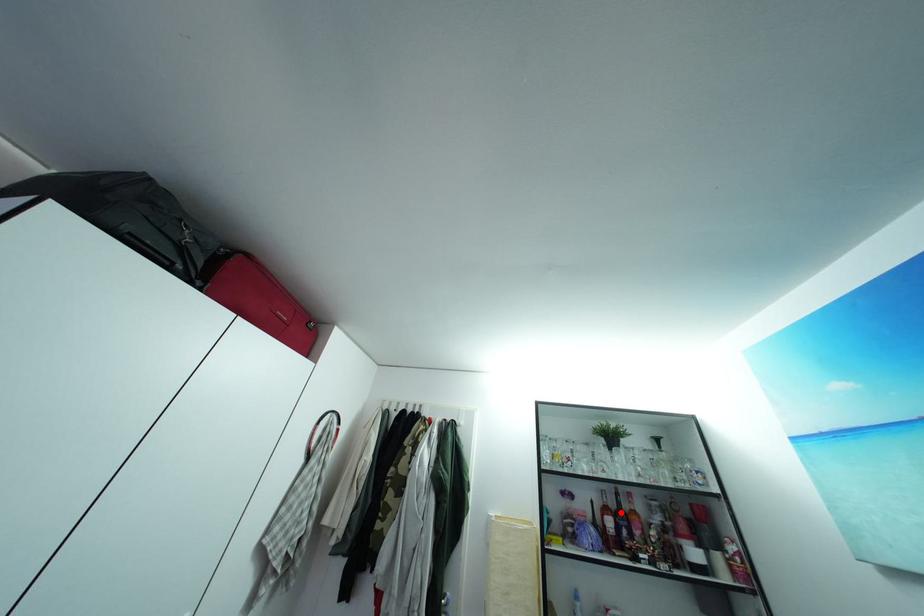
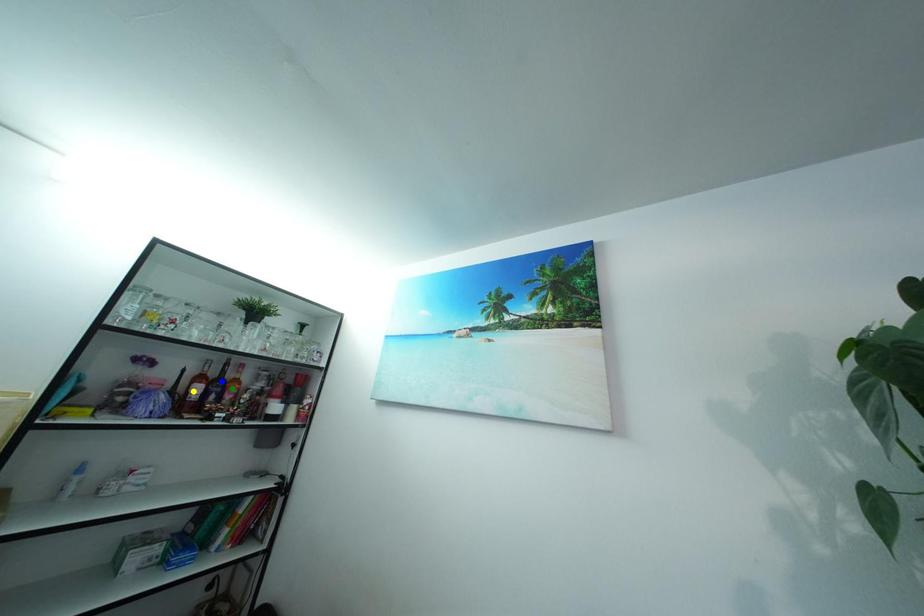
Question: I am providing you with two images of the same scene from different viewpoints. A red point is marked on the first image. You are given multiple points on the second image. In image 2, which mark is for the same physical point as the one in image 1?

Choices:
 (A) yellow point
 (B) blue point
 (C) green point

Answer: (B)